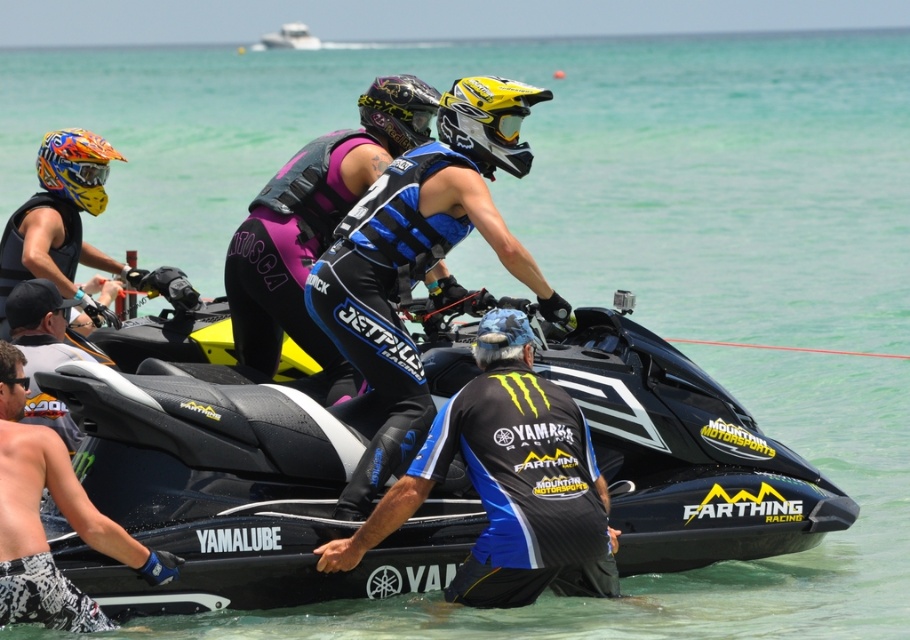
Is shiny blue and black wetsuit at center above brushed metal goggles at upper left?

No, shiny blue and black wetsuit at center is not above brushed metal goggles at upper left.

Does shiny blue and black wetsuit at center have a greater width compared to brushed metal goggles at upper left?

Indeed, shiny blue and black wetsuit at center has a greater width compared to brushed metal goggles at upper left.

Is point (430, 218) more distant than point (103, 164)?

That is False.

Find the location of a particular element. shiny blue and black wetsuit at center is located at coordinates (420, 259).

Looking at this image, is black matte jet ski at center bigger than matte black wetsuit at center?

Correct, black matte jet ski at center is larger in size than matte black wetsuit at center.

The height and width of the screenshot is (640, 910). I want to click on black matte jet ski at center, so [238, 492].

Identify the location of black matte jet ski at center. (238, 492).

This screenshot has width=910, height=640. Describe the element at coordinates (57, 220) in the screenshot. I see `matte black helmet at left` at that location.

Who is lower down, matte black helmet at left or white glossy boat at upper center?

Positioned lower is matte black helmet at left.

Locate an element on the screen. Image resolution: width=910 pixels, height=640 pixels. matte black helmet at left is located at coordinates point(57,220).

Locate an element on the screen. The image size is (910, 640). matte black helmet at left is located at coordinates (57, 220).